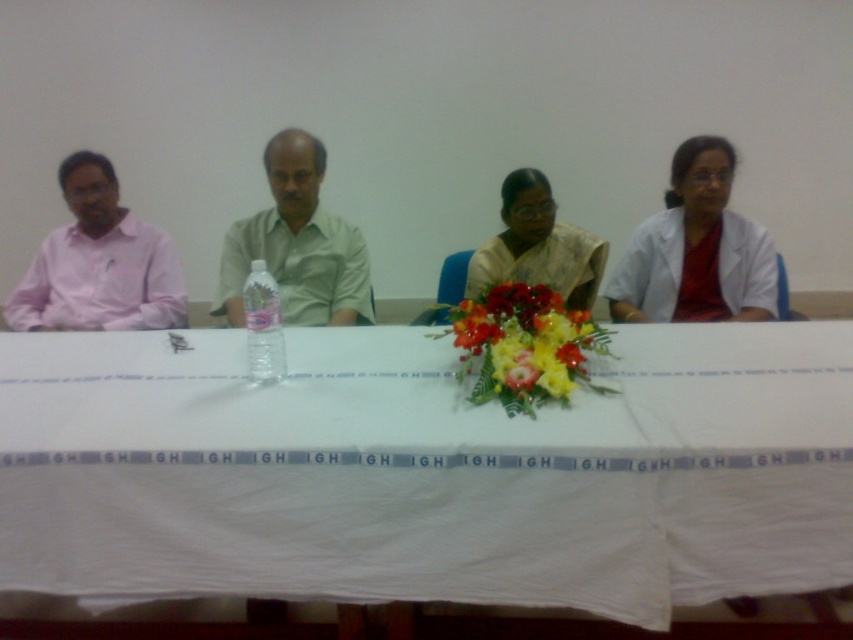
Question: Which of the following is the closest to the observer?

Choices:
 (A) vibrant floral bouquet at center
 (B) satin yellow saree at center

Answer: (A)

Question: Can you confirm if white cloth at center is positioned below white matte coat at right?

Choices:
 (A) yes
 (B) no

Answer: (A)

Question: Which object is positioned farthest from the green matte shirt at center?

Choices:
 (A) satin yellow saree at center
 (B) white matte coat at right
 (C) vibrant floral bouquet at center
 (D) pink matte shirt at left

Answer: (B)

Question: Among these objects, which one is farthest from the camera?

Choices:
 (A) green matte shirt at center
 (B) white cloth at center

Answer: (A)

Question: Does pink matte shirt at left appear over satin yellow saree at center?

Choices:
 (A) yes
 (B) no

Answer: (A)

Question: Does white cloth at center lie behind satin yellow saree at center?

Choices:
 (A) yes
 (B) no

Answer: (B)